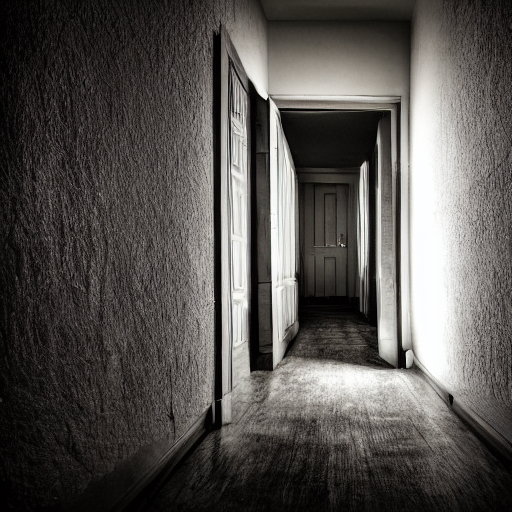
Where is `skirting`? skirting is located at coordinates (492, 434).